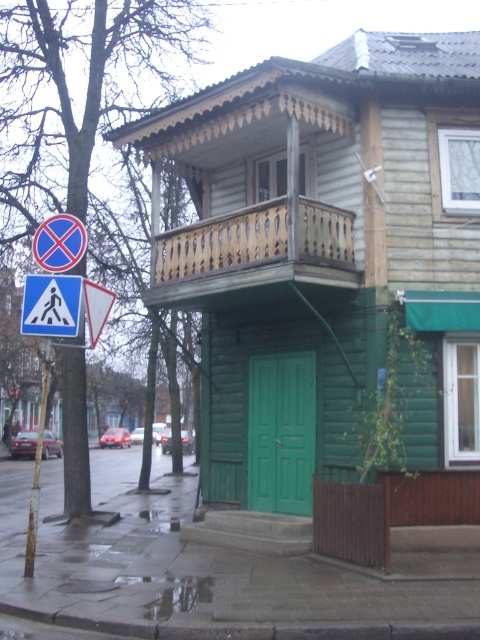
Question: Among these objects, which one is nearest to the camera?

Choices:
 (A) blue plastic pedestrian crossing sign at upper left
 (B) white plastic pedestrian crossing sign at upper left

Answer: (B)

Question: In this image, where is white plastic pedestrian crossing sign at upper left located relative to blue plastic pedestrian crossing sign at upper left?

Choices:
 (A) right
 (B) left

Answer: (B)

Question: Is white plastic pedestrian crossing sign at upper left to the left of blue plastic pedestrian crossing sign at upper left from the viewer's perspective?

Choices:
 (A) yes
 (B) no

Answer: (A)

Question: Which object is closer to the camera taking this photo?

Choices:
 (A) white plastic pedestrian crossing sign at upper left
 (B) blue plastic pedestrian crossing sign at upper left

Answer: (A)

Question: Can you confirm if white plastic pedestrian crossing sign at upper left is positioned above blue plastic pedestrian crossing sign at upper left?

Choices:
 (A) yes
 (B) no

Answer: (B)